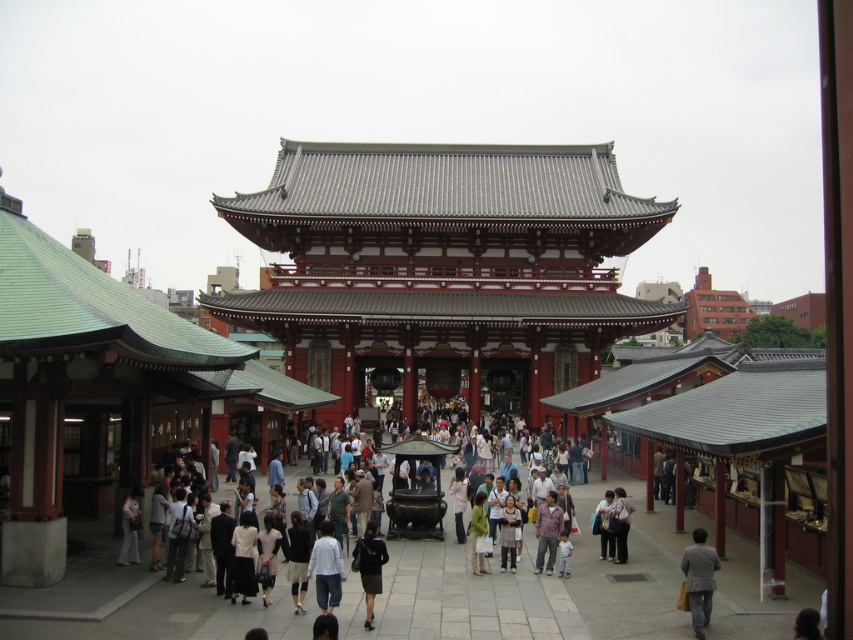
Does red lacquered temple gate at center have a greater width compared to black fabric skirt at center?

Yes, red lacquered temple gate at center is wider than black fabric skirt at center.

Is red lacquered temple gate at center in front of black fabric skirt at center?

No, red lacquered temple gate at center is behind black fabric skirt at center.

Between point (544, 225) and point (364, 625), which one is positioned behind?

Positioned behind is point (544, 225).

Locate an element on the screen. This screenshot has width=853, height=640. red lacquered temple gate at center is located at coordinates (444, 268).

Can you confirm if black fabric skirt at center is taller than printed cotton shirt at center?

Incorrect, black fabric skirt at center's height is not larger of printed cotton shirt at center's.

Who is more forward, (373, 580) or (537, 554)?

Point (373, 580)

Does point (366, 584) come behind point (543, 557)?

No, (366, 584) is closer to viewer.

The height and width of the screenshot is (640, 853). What are the coordinates of `black fabric skirt at center` in the screenshot? It's located at (369, 566).

Which is behind, point (650, 330) or point (543, 529)?

Positioned behind is point (650, 330).

Which is above, red lacquered temple gate at center or printed cotton shirt at center?

red lacquered temple gate at center

Between point (357, 362) and point (540, 508), which one is positioned in front?

Positioned in front is point (540, 508).

What are the coordinates of `red lacquered temple gate at center` in the screenshot? It's located at (444, 268).